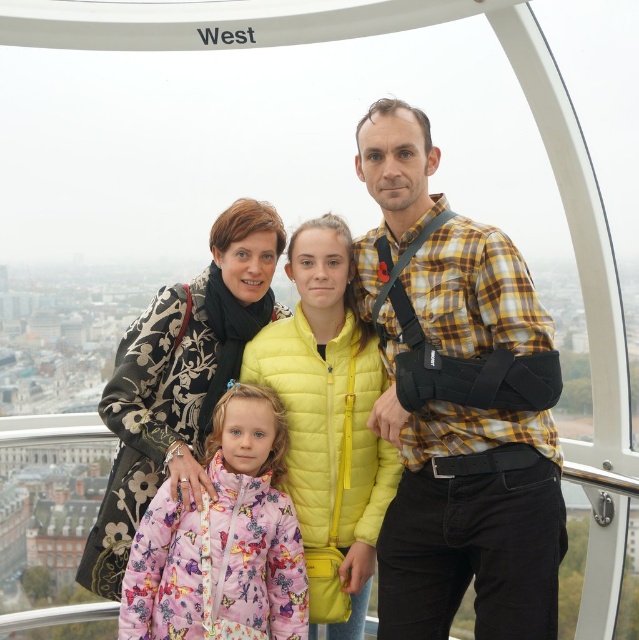
What is the color of the object located at the point with coordinates [458,403] in the London Eye pod?

The object at point [458,403] is a yellow quilted jacket.

Looking at this image, you are standing inside the London Eye pod and want to hand a souvenir to the person wearing the yellow plaid shirt at center. Based on their position, where should you aim to place the item so it reaches them accurately?

The yellow plaid shirt at center is located at point [458,403], so you should aim for that coordinate to ensure the item reaches them accurately.